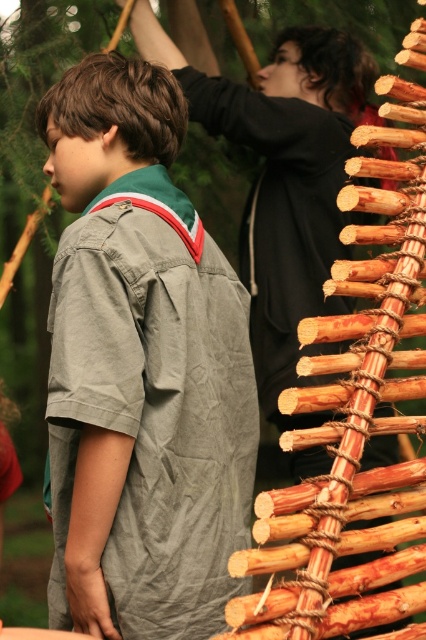
Which is below, gray cotton shirt at center or smooth black hoodie at upper center?

Answer: gray cotton shirt at center is lower down.

Can you confirm if gray cotton shirt at center is wider than smooth black hoodie at upper center?

Incorrect, gray cotton shirt at center's width does not surpass smooth black hoodie at upper center's.

Identify the location of gray cotton shirt at center. (141, 371).